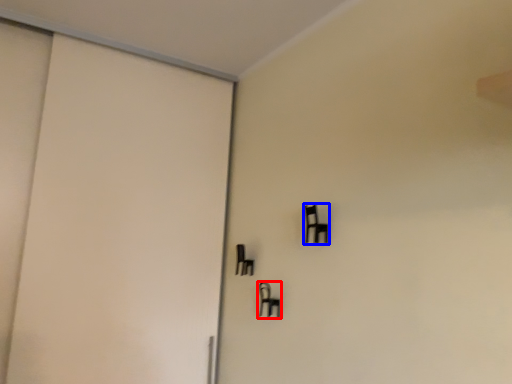
Question: Which of the following is the closest to the observer, furniture (highlighted by a red box) or furniture (highlighted by a blue box)?

Choices:
 (A) furniture
 (B) furniture

Answer: (B)